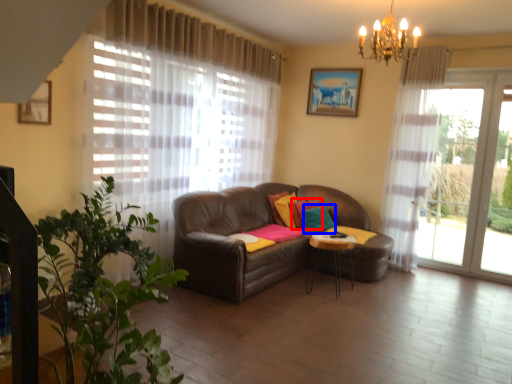
Question: Which of the following is the closest to the observer, pillow (highlighted by a red box) or pillow (highlighted by a blue box)?

Choices:
 (A) pillow
 (B) pillow

Answer: (B)